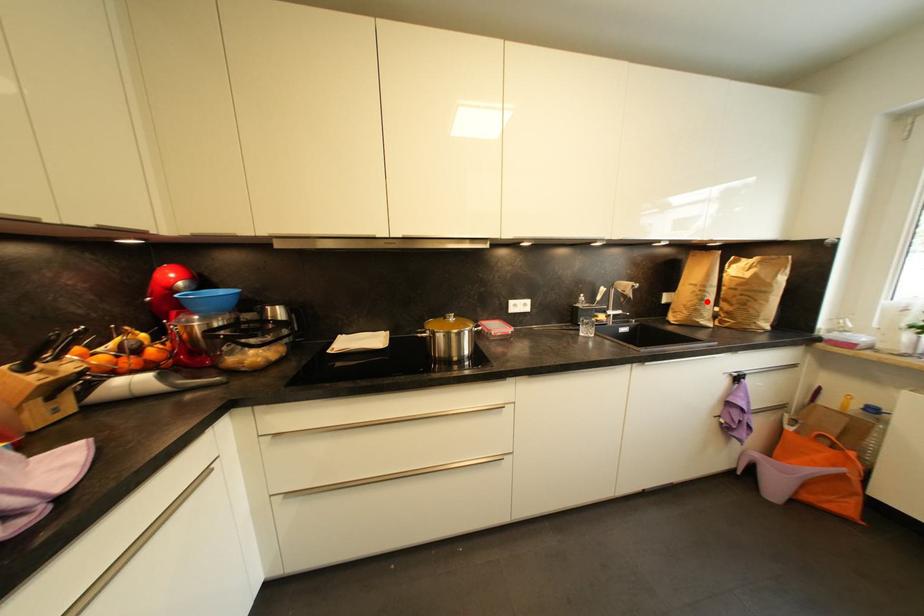
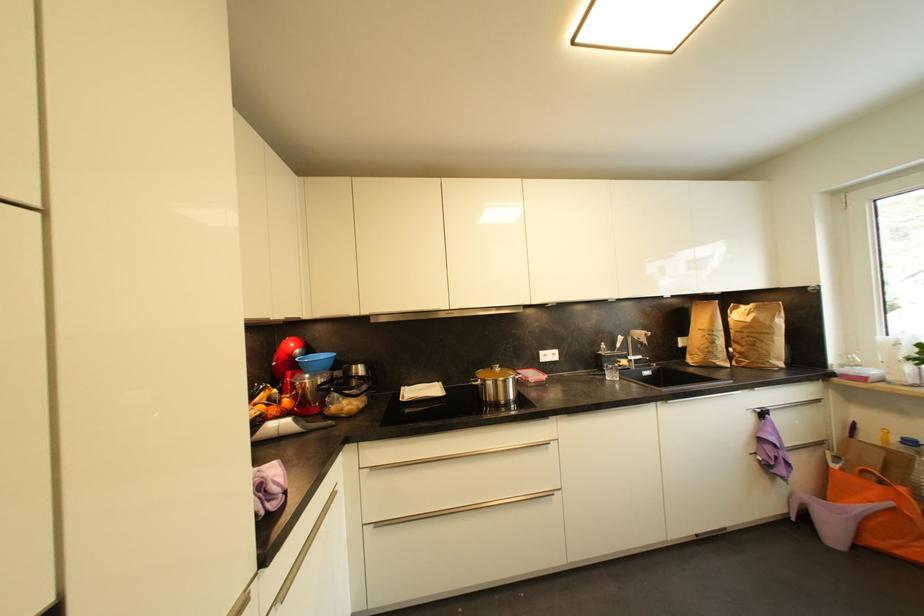
In the second image, find the point that corresponds to the highlighted location in the first image.

(718, 345)